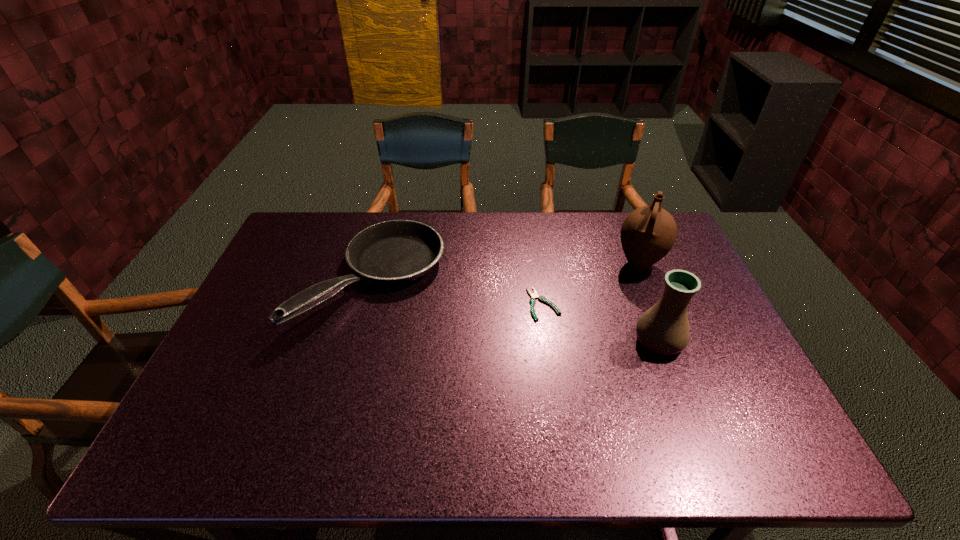
In order to click on empty location between the pitcher and the leftmost object in this screenshot , I will do `click(506, 272)`.

Identify which object is the second nearest to the shortest object. Please provide its 2D coordinates. Your answer should be formatted as a tuple, i.e. [(x, y)], where the tuple contains the x and y coordinates of a point satisfying the conditions above.

[(648, 233)]

The width and height of the screenshot is (960, 540). What are the coordinates of `object that is the third closest to the second shortest object` in the screenshot? It's located at (648, 233).

This screenshot has height=540, width=960. I want to click on vacant position in the image that satisfies the following two spatial constraints: 1. on the front side of the shortest object; 2. on the left side of the third tallest object, so click(368, 304).

Identify the location of free space that satisfies the following two spatial constraints: 1. on the front side of the shortest object; 2. on the right side of the pottery. (549, 341).

Identify the location of free location that satisfies the following two spatial constraints: 1. on the front side of the second shortest object; 2. on the right side of the pottery. Image resolution: width=960 pixels, height=540 pixels. (358, 341).

Where is `blank space that satisfies the following two spatial constraints: 1. on the front side of the second object from left to right; 2. on the right side of the pottery`? blank space that satisfies the following two spatial constraints: 1. on the front side of the second object from left to right; 2. on the right side of the pottery is located at coordinates (549, 341).